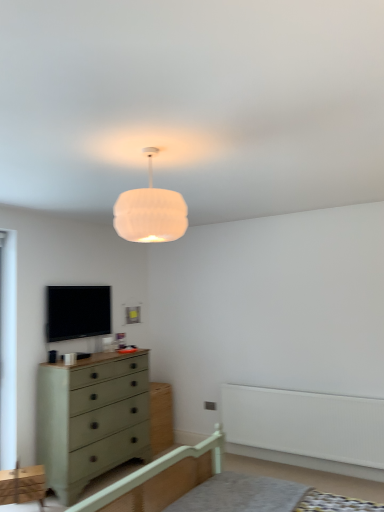
Question: Is white fabric lampshade at upper center outside of white painted wood bed frame at center?

Choices:
 (A) no
 (B) yes

Answer: (B)

Question: Is white fabric lampshade at upper center positioned behind white painted wood bed frame at center?

Choices:
 (A) no
 (B) yes

Answer: (B)

Question: From the image's perspective, is white fabric lampshade at upper center over white painted wood bed frame at center?

Choices:
 (A) no
 (B) yes

Answer: (B)

Question: Considering the relative positions of white fabric lampshade at upper center and white painted wood bed frame at center in the image provided, is white fabric lampshade at upper center to the right of white painted wood bed frame at center from the viewer's perspective?

Choices:
 (A) no
 (B) yes

Answer: (A)

Question: Can you confirm if white fabric lampshade at upper center is thinner than white painted wood bed frame at center?

Choices:
 (A) yes
 (B) no

Answer: (A)

Question: Can you confirm if white fabric lampshade at upper center is taller than white painted wood bed frame at center?

Choices:
 (A) no
 (B) yes

Answer: (A)

Question: Does white plastic balustrade at lower right come behind green matte cabinet at lower left?

Choices:
 (A) no
 (B) yes

Answer: (B)

Question: From the image's perspective, is white plastic balustrade at lower right above green matte cabinet at lower left?

Choices:
 (A) no
 (B) yes

Answer: (B)

Question: Is white plastic balustrade at lower right thinner than green matte cabinet at lower left?

Choices:
 (A) no
 (B) yes

Answer: (B)

Question: Is white plastic balustrade at lower right outside of green matte cabinet at lower left?

Choices:
 (A) no
 (B) yes

Answer: (B)

Question: Can green matte cabinet at lower left be found inside white plastic balustrade at lower right?

Choices:
 (A) no
 (B) yes

Answer: (A)

Question: Is white plastic balustrade at lower right positioned in front of green matte cabinet at lower left?

Choices:
 (A) yes
 (B) no

Answer: (B)

Question: Is black glossy tv at upper left not close to white fabric lampshade at upper center?

Choices:
 (A) no
 (B) yes

Answer: (B)